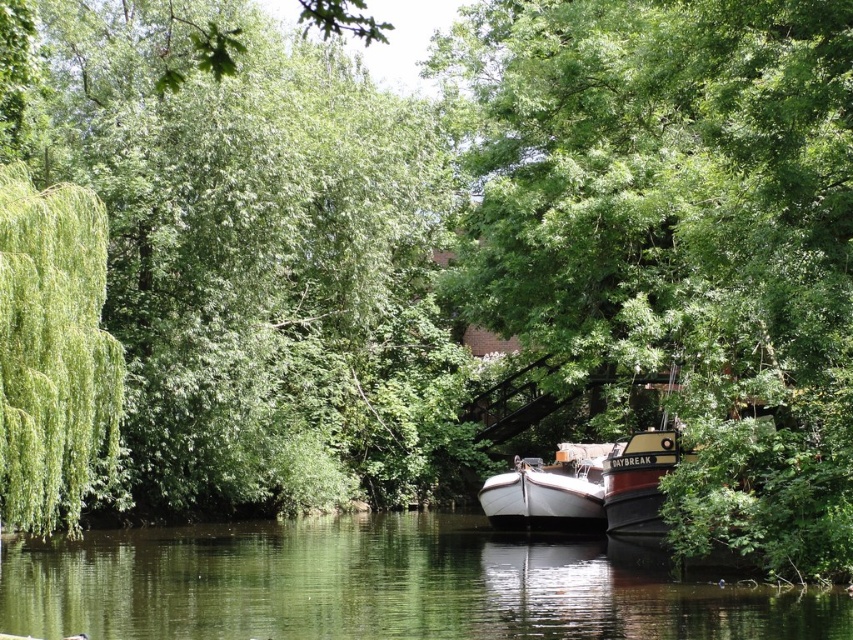
Question: Where is green smooth water at center located in relation to white matte boat at center in the image?

Choices:
 (A) left
 (B) right

Answer: (A)

Question: In this image, where is green smooth water at center located relative to white matte boat at center?

Choices:
 (A) left
 (B) right

Answer: (A)

Question: Which point is closer to the camera taking this photo?

Choices:
 (A) (779, 614)
 (B) (514, 468)

Answer: (A)

Question: Can you confirm if green smooth water at center is positioned above white matte boat at center?

Choices:
 (A) no
 (B) yes

Answer: (A)

Question: Which point appears closest to the camera in this image?

Choices:
 (A) (143, 625)
 (B) (508, 492)

Answer: (A)